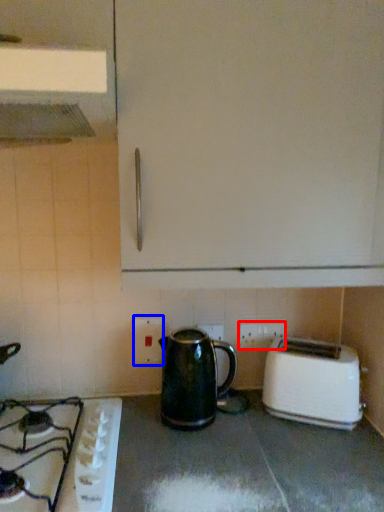
Question: Which of the following is the closest to the observer, electric outlet (highlighted by a red box) or electric outlet (highlighted by a blue box)?

Choices:
 (A) electric outlet
 (B) electric outlet

Answer: (B)